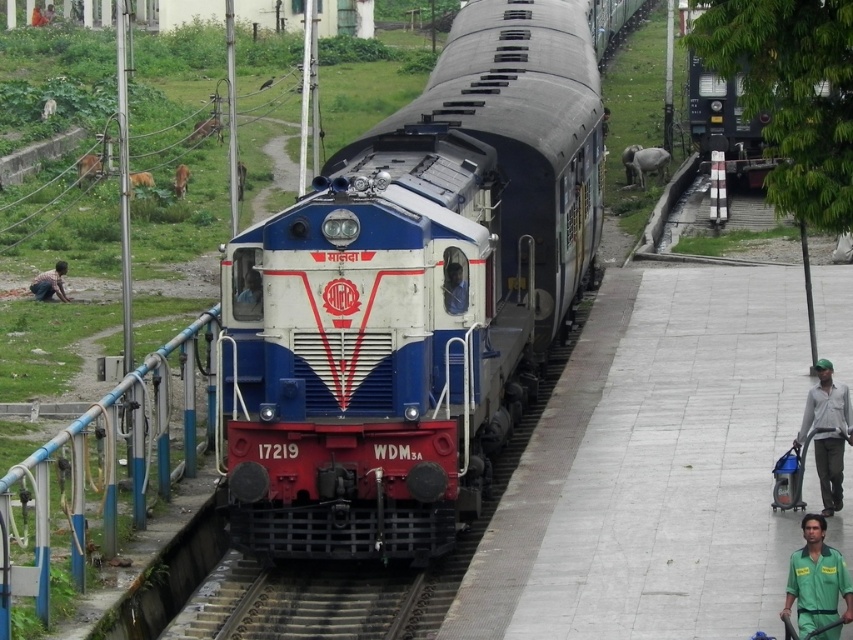
This screenshot has height=640, width=853. Describe the element at coordinates (86, 477) in the screenshot. I see `blue painted metal railing at lower left` at that location.

Which is more to the right, blue painted metal railing at lower left or metallic helmet at center?

metallic helmet at center

Locate an element on the screen. This screenshot has height=640, width=853. blue painted metal railing at lower left is located at coordinates (86, 477).

Identify the location of green fabric shirt at right. (827, 433).

Is green fabric shirt at right thinner than brown skin person at lower left?

Indeed, green fabric shirt at right has a lesser width compared to brown skin person at lower left.

What are the coordinates of `green fabric shirt at right` in the screenshot? It's located at (827, 433).

Is point (62, 269) positioned after point (45, 20)?

That is False.

Measure the distance between point (51, 291) and camera.

Point (51, 291) is 34.68 meters from camera.

Find the location of a particular element. brown skin person at lower left is located at coordinates (49, 284).